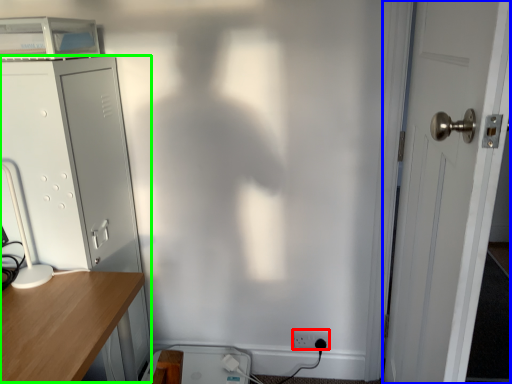
Question: Which object is positioned farthest from electric outlet (highlighted by a red box)? Select from door (highlighted by a blue box) and file cabinet (highlighted by a green box).

Choices:
 (A) door
 (B) file cabinet

Answer: (B)